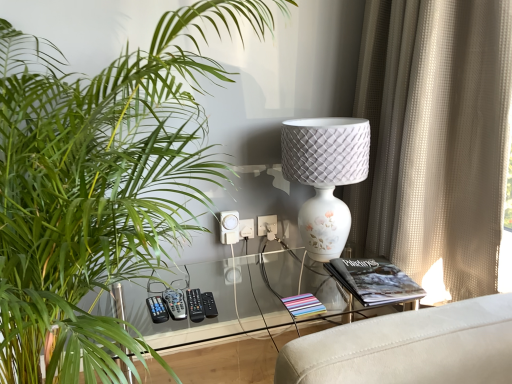
Question: Is gray plastic remote at lower center, the 3th control viewed from the right, surrounded by green leafy plant at left?

Choices:
 (A) yes
 (B) no

Answer: (A)

Question: From the image's perspective, would you say green leafy plant at left is shown under gray plastic remote at lower center, the 3th control viewed from the right?

Choices:
 (A) yes
 (B) no

Answer: (B)

Question: Is green leafy plant at left oriented towards gray plastic remote at lower center, the 3th control viewed from the right?

Choices:
 (A) yes
 (B) no

Answer: (A)

Question: Does green leafy plant at left come in front of gray plastic remote at lower center, the 3th control viewed from the right?

Choices:
 (A) no
 (B) yes

Answer: (B)

Question: Considering the relative positions of green leafy plant at left and gray plastic remote at lower center, the 1th control in the left-to-right sequence, in the image provided, is green leafy plant at left to the left of gray plastic remote at lower center, the 1th control in the left-to-right sequence, from the viewer's perspective?

Choices:
 (A) yes
 (B) no

Answer: (A)

Question: From a real-world perspective, is white plastic electric outlet at center, which is the second electric outlet from right to left, physically located above or below black plastic remote at center, the second control from the right?

Choices:
 (A) above
 (B) below

Answer: (A)

Question: Is white plastic electric outlet at center, which is counted as the 1th electric outlet, starting from the left, inside the boundaries of black plastic remote at center, which appears as the 2th control when viewed from the left, or outside?

Choices:
 (A) outside
 (B) inside

Answer: (A)

Question: Is white plastic electric outlet at center, which is counted as the 1th electric outlet, starting from the left, taller or shorter than black plastic remote at center, the second control from the right?

Choices:
 (A) tall
 (B) short

Answer: (A)

Question: Considering their positions, is white plastic electric outlet at center, which is counted as the 1th electric outlet, starting from the left, located in front of or behind black plastic remote at center, which appears as the 2th control when viewed from the left?

Choices:
 (A) behind
 (B) front

Answer: (A)

Question: Which is correct: beige textured curtain at right is inside black matte book at right, or outside of it?

Choices:
 (A) outside
 (B) inside

Answer: (A)

Question: Considering the positions of beige textured curtain at right and black matte book at right in the image, is beige textured curtain at right taller or shorter than black matte book at right?

Choices:
 (A) short
 (B) tall

Answer: (B)

Question: Considering the positions of point (407, 31) and point (362, 281), is point (407, 31) closer or farther from the camera than point (362, 281)?

Choices:
 (A) closer
 (B) farther

Answer: (B)

Question: Considering the positions of beige textured curtain at right and black matte book at right in the image, is beige textured curtain at right bigger or smaller than black matte book at right?

Choices:
 (A) big
 (B) small

Answer: (A)

Question: Would you say black plastic remote at center, the second control from the right, is inside or outside black matte book at right?

Choices:
 (A) outside
 (B) inside

Answer: (A)

Question: Is black plastic remote at center, which appears as the 2th control when viewed from the left, bigger or smaller than black matte book at right?

Choices:
 (A) big
 (B) small

Answer: (B)